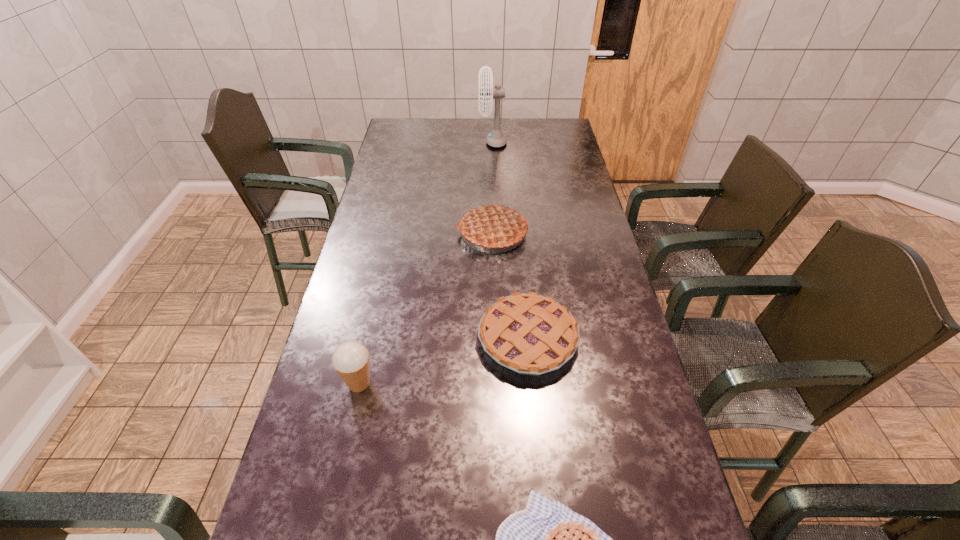
Locate an element on the screen. free spot located on the front-facing side of the tallest object is located at coordinates (430, 142).

At what (x,y) coordinates should I click in order to perform the action: click on vacant area situated on the back of the second tallest object. Please return your answer as a coordinate pair (x, y). Image resolution: width=960 pixels, height=540 pixels. Looking at the image, I should click on (490, 161).

Locate an element on the screen. The width and height of the screenshot is (960, 540). blank space located 0.400m on the back of the third tallest object is located at coordinates (385, 264).

Locate an element on the screen. vacant space located on the front of the second tallest pie is located at coordinates (540, 466).

At what (x,y) coordinates should I click in order to perform the action: click on object present at the far edge. Please return your answer as a coordinate pair (x, y). This screenshot has width=960, height=540. Looking at the image, I should click on (496, 138).

Find the location of `object that is at the left edge`. object that is at the left edge is located at coordinates (350, 359).

Locate an element on the screen. The image size is (960, 540). object at the right edge is located at coordinates (530, 334).

In the image, there is a desktop. Identify the location of vacant region at the far edge. (459, 121).

Find the location of a particular element. free space at the left edge of the desktop is located at coordinates (353, 267).

Locate an element on the screen. This screenshot has width=960, height=540. vacant space at the right edge is located at coordinates (625, 315).